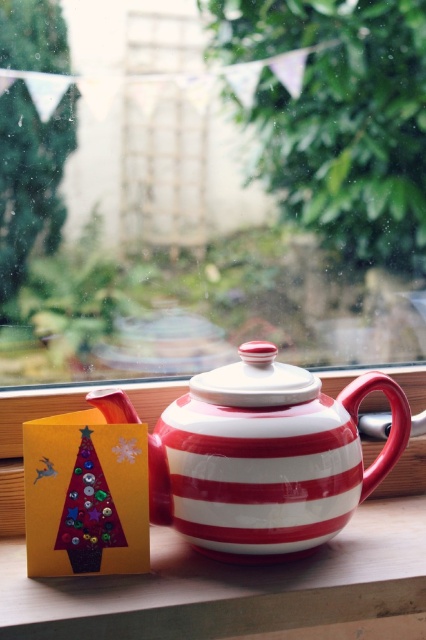
You are an interior designer arranging a holiday display. You have a transparent glass window at center and a red and white striped teapot at center. Which object is taller?

The transparent glass window at center is taller than the red and white striped teapot at center.

You are arranging a holiday display and need to place a decorative item between the red and white striped teapot at center and the wooden ledge at lower left. Based on their positions, where should you place the item to ensure it is between them?

The red and white striped teapot at center is to the right of the wooden ledge at lower left, so placing the decorative item between them would require positioning it to the right of the wooden ledge at lower left and to the left of the red and white striped teapot at center.

You are standing in the room and want to pour yourself a cup of tea using the red and white striped teapot at center. If your arm can reach 24 inches, can you comfortably reach the teapot without moving closer?

The red and white striped teapot at center is 28.28 inches away from the viewer. Since your arm can only reach 24 inches, you cannot comfortably reach the teapot without moving closer.